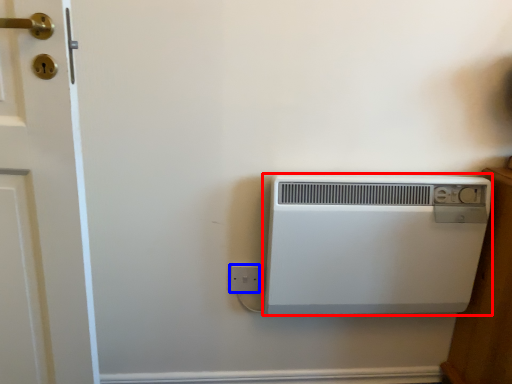
Question: Which object is closer to the camera taking this photo, home appliance (highlighted by a red box) or electric outlet (highlighted by a blue box)?

Choices:
 (A) home appliance
 (B) electric outlet

Answer: (A)